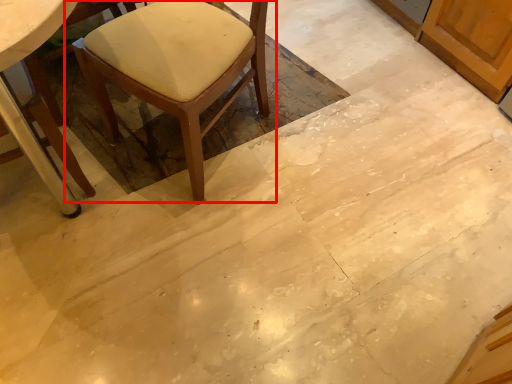
Question: From the image's perspective, what is the correct spatial relationship of chair (annotated by the red box) in relation to chair?

Choices:
 (A) below
 (B) above

Answer: (B)